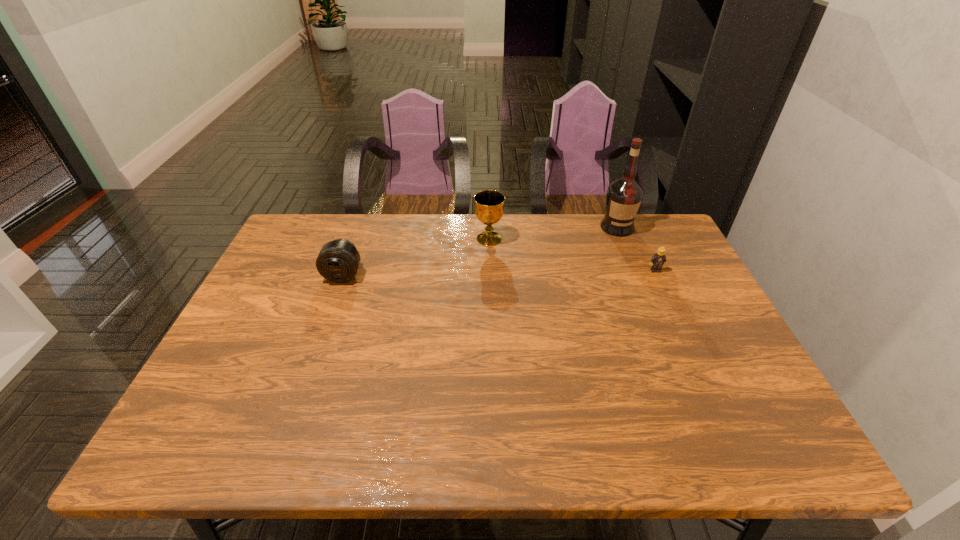
Locate an element on the screen. The height and width of the screenshot is (540, 960). liquor is located at coordinates (624, 196).

Identify the location of the third shortest object. The image size is (960, 540). (489, 210).

This screenshot has height=540, width=960. I want to click on chalice, so click(489, 210).

Where is `telephoto lens`? The image size is (960, 540). telephoto lens is located at coordinates (338, 260).

This screenshot has width=960, height=540. In order to click on the third tallest object in this screenshot , I will do `click(338, 260)`.

Where is `Lego`? Lego is located at coordinates (657, 260).

Where is `vacant region located 0.240m on the surface of the liquor`? This screenshot has height=540, width=960. vacant region located 0.240m on the surface of the liquor is located at coordinates (642, 288).

Where is `vacant area situated on the front of the third shortest object`? The width and height of the screenshot is (960, 540). vacant area situated on the front of the third shortest object is located at coordinates (491, 310).

What are the coordinates of `vacant position located on the front-facing side of the telephoto lens` in the screenshot? It's located at (322, 335).

Identify the location of vacant space located 0.290m in front of the shortest object. (693, 352).